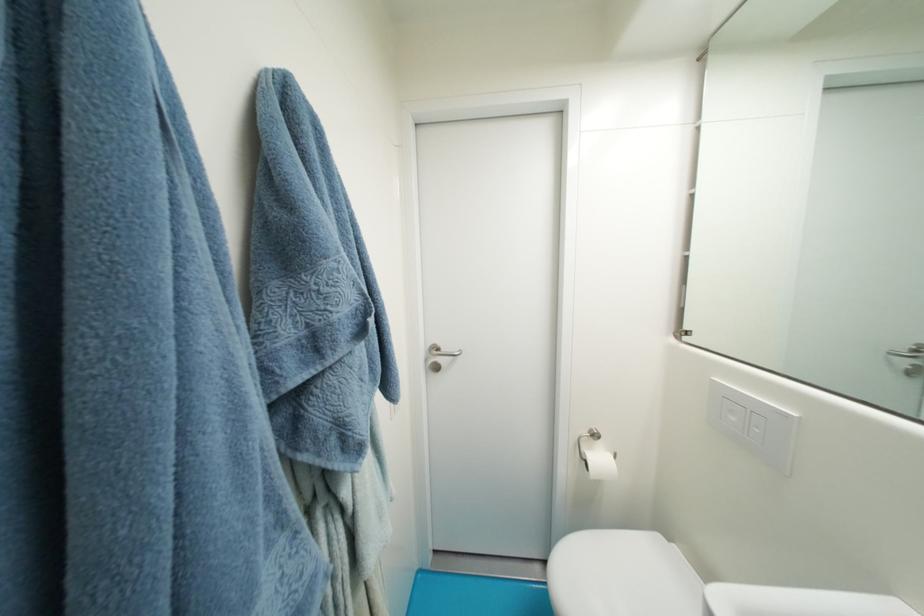
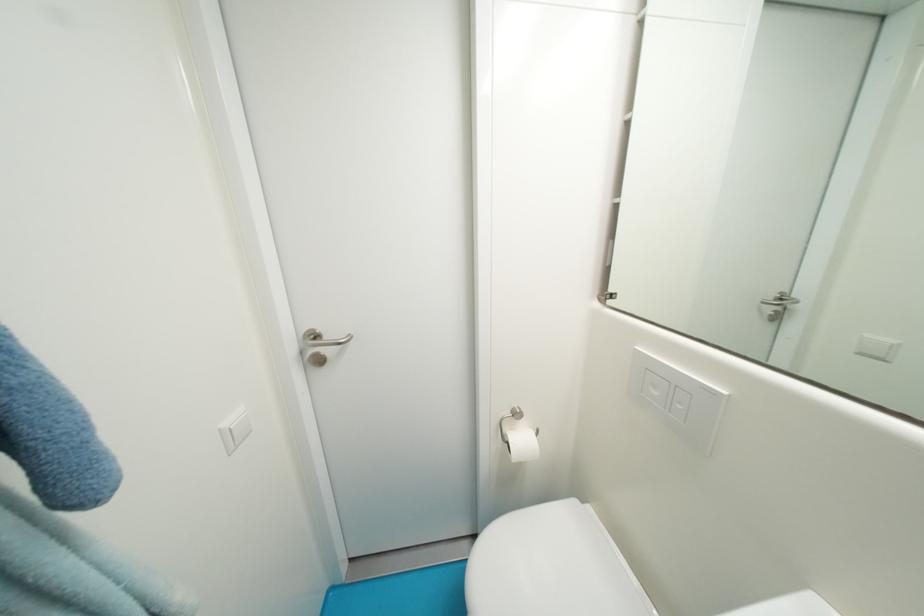
Find the pixel in the second image that matches the point at 606,461 in the first image.

(529, 442)